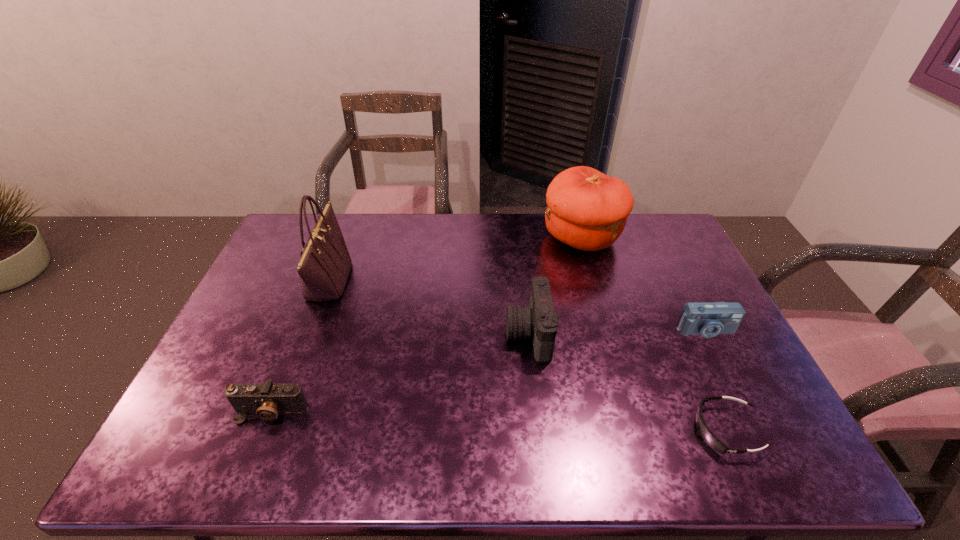
Locate an element on the screen. handbag is located at coordinates (324, 265).

Image resolution: width=960 pixels, height=540 pixels. What are the coordinates of `pumpkin` in the screenshot? It's located at click(x=586, y=209).

Find the location of a particular element. The width and height of the screenshot is (960, 540). the third object from left to right is located at coordinates (538, 320).

Locate an element on the screen. The height and width of the screenshot is (540, 960). the tallest camera is located at coordinates (538, 320).

The image size is (960, 540). I want to click on the rightmost camera, so tap(708, 319).

The width and height of the screenshot is (960, 540). I want to click on the leftmost camera, so click(267, 400).

This screenshot has height=540, width=960. In order to click on the shortest object in this screenshot , I will do 709,438.

This screenshot has width=960, height=540. I want to click on vacant region located on the front-facing side of the tallest object, so click(x=440, y=280).

You are a GUI agent. You are given a task and a screenshot of the screen. Output one action in this format:
    pyautogui.click(x=<x>, y=<y>)
    Task: Click on the free space located 0.060m on the left of the second tallest object
    
    Given the screenshot: What is the action you would take?
    pyautogui.click(x=526, y=237)

Where is `free region located at the lens of the tallest camera`? This screenshot has width=960, height=540. free region located at the lens of the tallest camera is located at coordinates (402, 334).